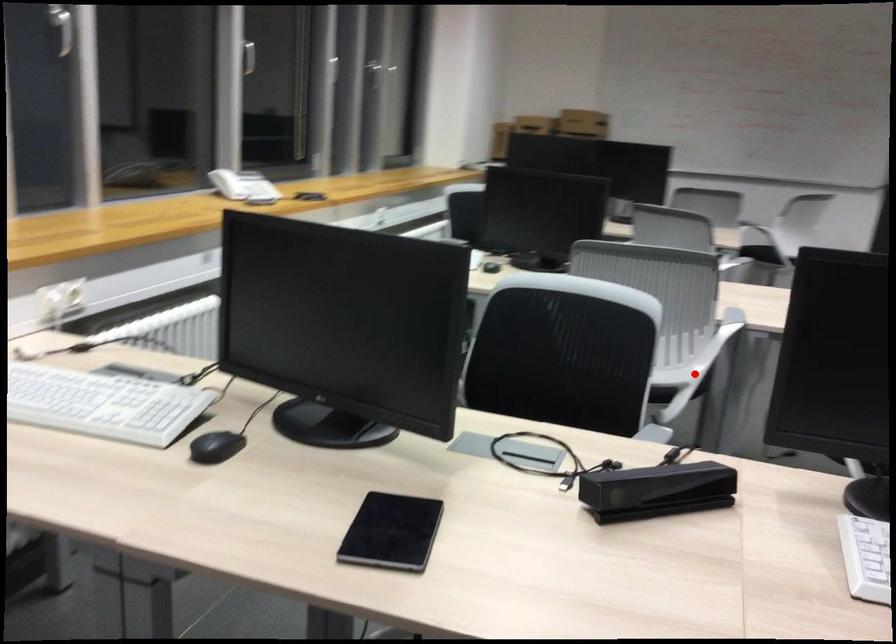
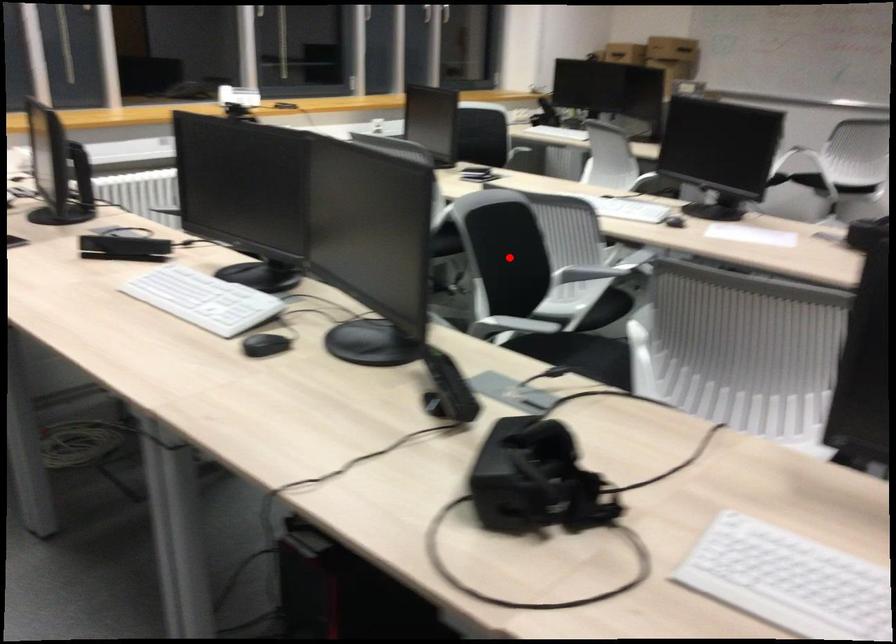
I am providing you with two images of the same scene from different viewpoints. A red point is marked on the first image and another point is marked on the second image. Do the highlighted points in image1 and image2 indicate the same real-world spot?

No